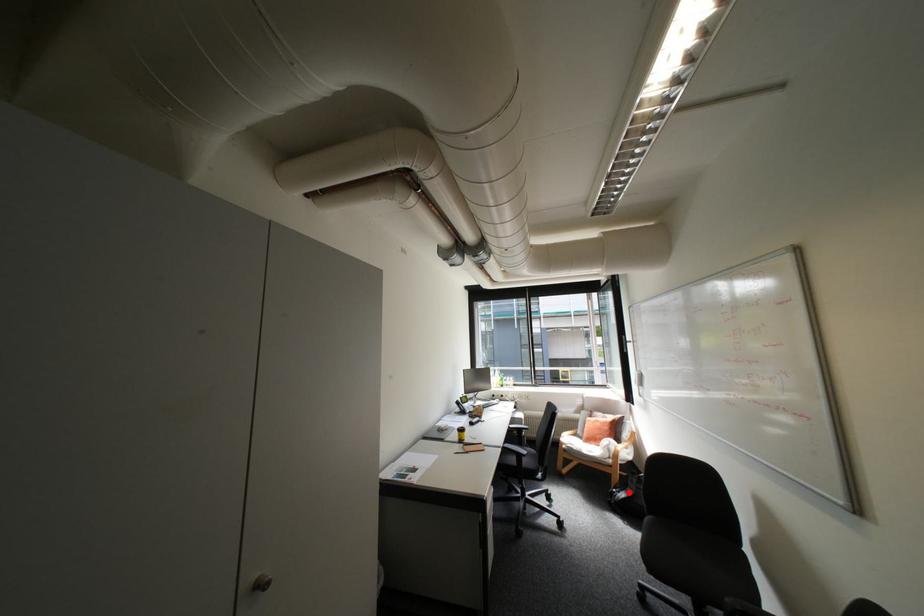
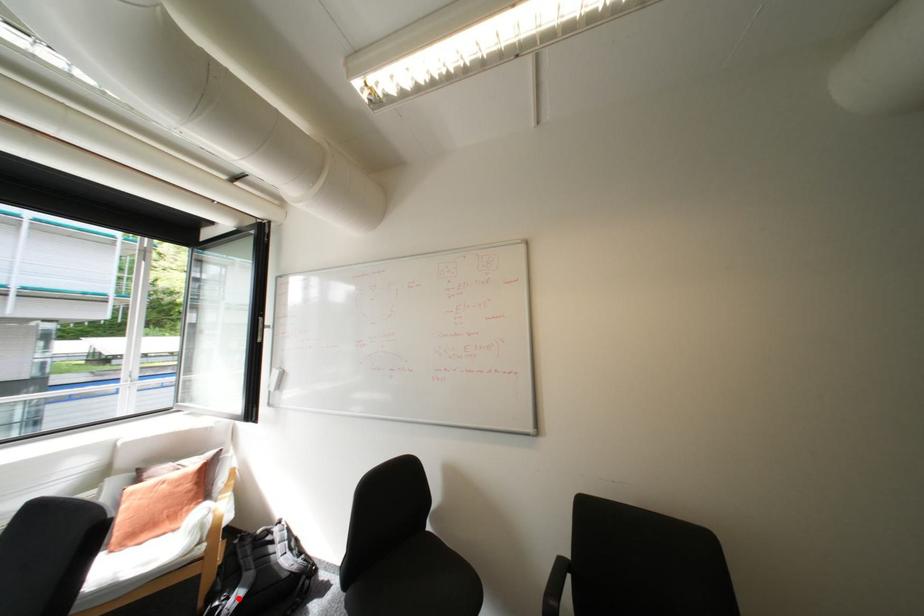
I am providing you with two images of the same scene from different viewpoints. A red point is marked on the first image and another point is marked on the second image. Are the points marked in image1 and image2 representing the same 3D position?

Yes